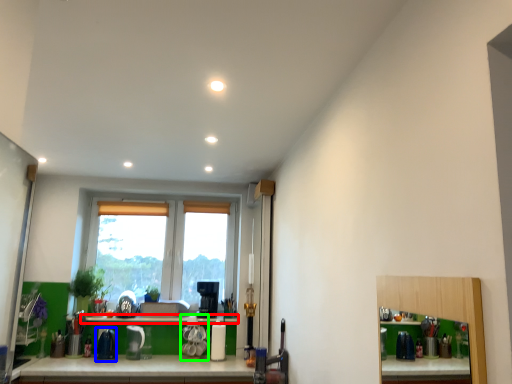
Question: Estimate the real-world distances between objects in this image. Which object is closer to window sill (highlighted by a red box), appliance (highlighted by a blue box) or appliance (highlighted by a green box)?

Choices:
 (A) appliance
 (B) appliance

Answer: (B)